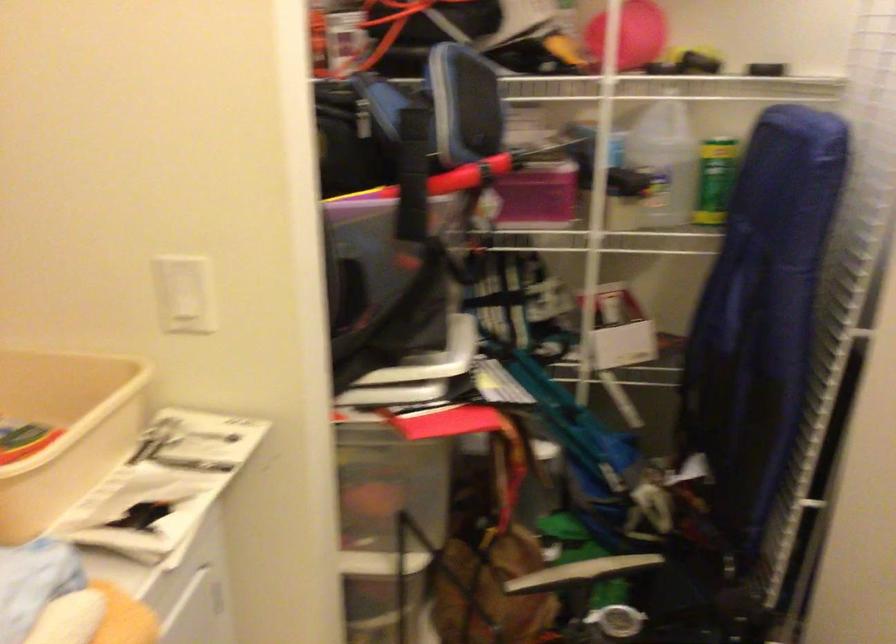
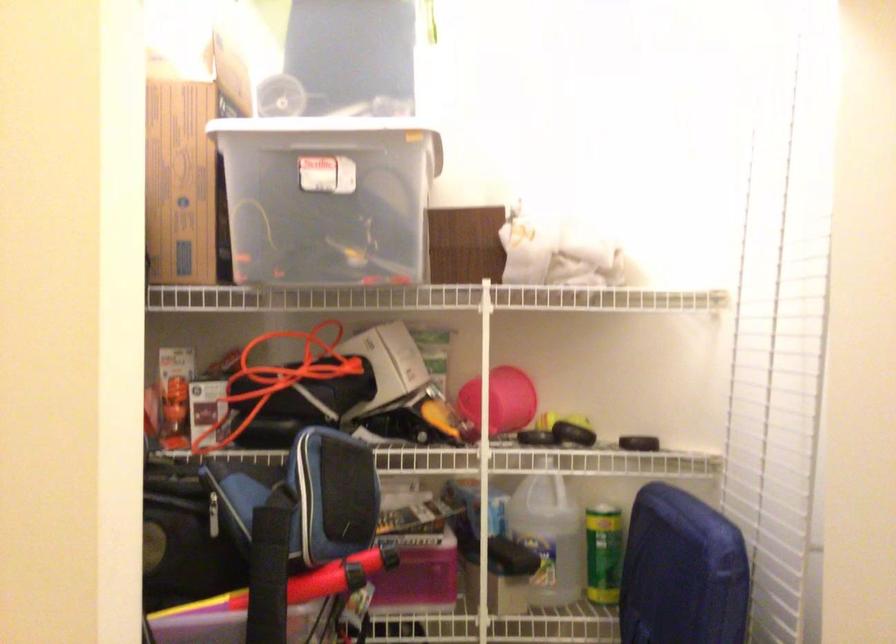
Where in the second image is the point corresponding to the point at 410,158 from the first image?

(269, 574)